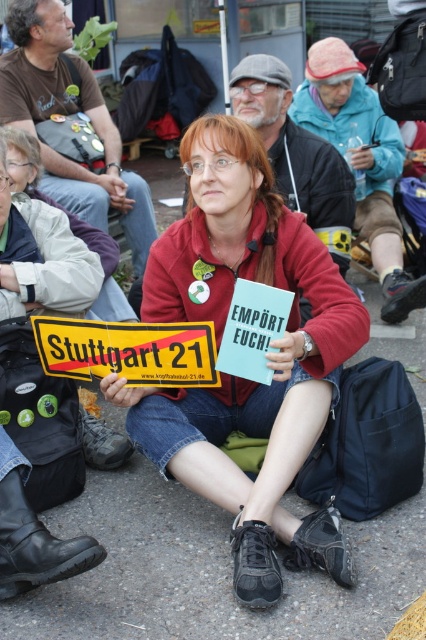
Is matte red jacket at center smaller than yellowplastic/stickerstuttgart 21 sign at center?

Actually, matte red jacket at center might be larger than yellowplastic/stickerstuttgart 21 sign at center.

Between matte red jacket at center and yellowplastic/stickerstuttgart 21 sign at center, which one has less height?

yellowplastic/stickerstuttgart 21 sign at center is shorter.

Who is more distant from viewer, (330,268) or (140,384)?

Point (330,268)

Identify the location of matte red jacket at center. Image resolution: width=426 pixels, height=640 pixels. (267, 356).